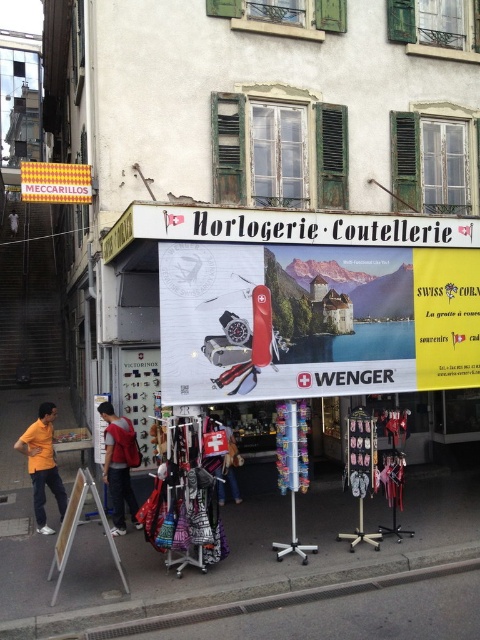
Is metallic silver knife at center shorter than gray concrete curb at lower center?

No.

Which of these two, metallic silver knife at center or gray concrete curb at lower center, stands taller?

With more height is metallic silver knife at center.

Does point (260, 252) come behind point (168, 612)?

Yes, it is.

In order to click on metallic silver knife at center in this screenshot , I will do `click(314, 321)`.

Who is positioned more to the right, red backpack at center or orange t-shirt at left?

From the viewer's perspective, red backpack at center appears more on the right side.

Between red backpack at center and orange t-shirt at left, which one is positioned lower?

red backpack at center is below.

This screenshot has width=480, height=640. I want to click on red backpack at center, so click(120, 465).

Does point (203, 381) lie in front of point (44, 422)?

Yes, point (203, 381) is closer to viewer.

Between point (285, 296) and point (23, 433), which one is positioned behind?

The point (23, 433) is behind.

Between point (396, 262) and point (36, 486), which one is positioned in front?

Point (396, 262) is more forward.

The height and width of the screenshot is (640, 480). Identify the location of metallic silver knife at center. (314, 321).